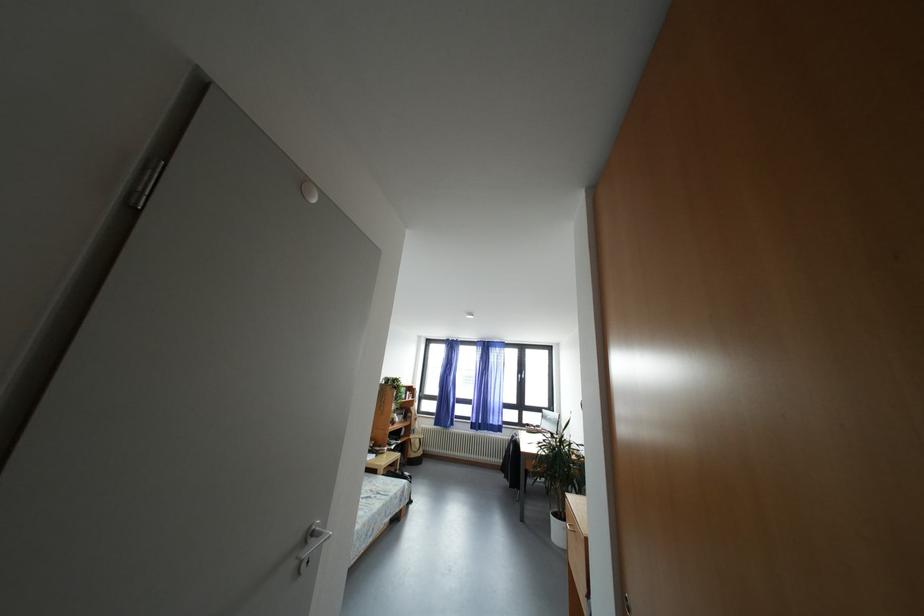
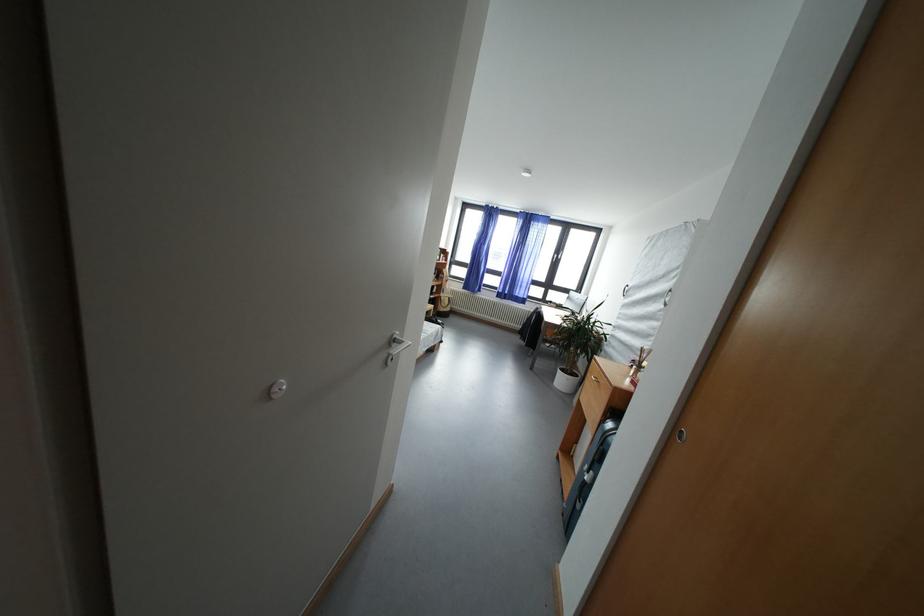
Question: Based on the continuous images, in which direction is the camera rotating? Reply with the corresponding letter.

Choices:
 (A) Left
 (B) Right
 (C) Up
 (D) Down

Answer: (D)